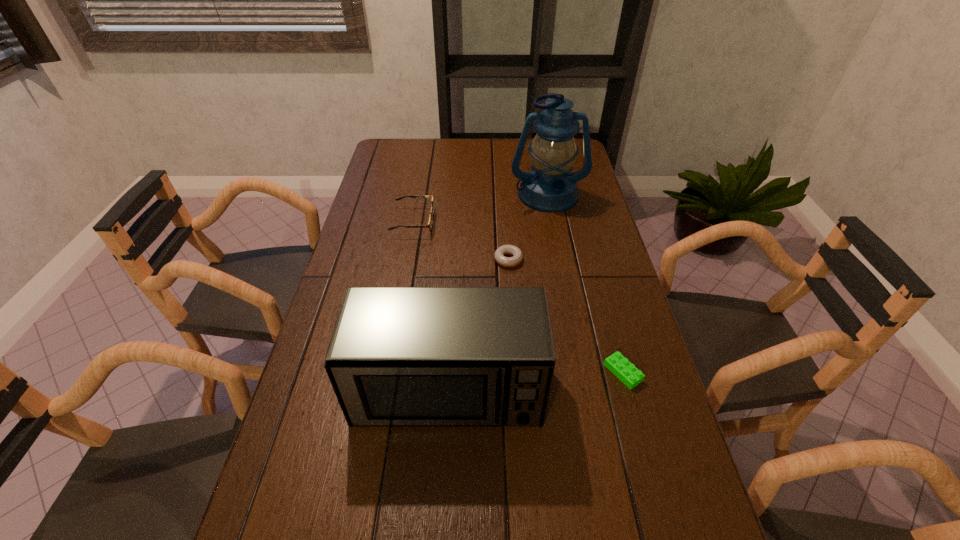
I want to click on lantern, so click(x=550, y=187).

The width and height of the screenshot is (960, 540). I want to click on the fourth shortest object, so click(399, 356).

Locate an element on the screen. spectacles is located at coordinates (430, 224).

Find the location of `doughnut`. doughnut is located at coordinates (517, 258).

Where is `Lego`? Lego is located at coordinates point(624,370).

You are a GUI agent. You are given a task and a screenshot of the screen. Output one action in this format:
    pyautogui.click(x=<x>, y=<y>)
    Task: Click on the free space located 0.210m on the face of the lantern
    Image resolution: width=960 pixels, height=540 pixels.
    Given the screenshot: What is the action you would take?
    pyautogui.click(x=560, y=254)

Identify the location of vacant space situated 0.050m on the front-facing side of the fourth shortest object. This screenshot has width=960, height=540. (444, 456).

You are a GUI agent. You are given a task and a screenshot of the screen. Output one action in this format:
    pyautogui.click(x=<x>, y=<y>)
    Task: Click on the free spot located on the frame of the third shortest object
    The image size is (960, 540).
    Given the screenshot: What is the action you would take?
    pyautogui.click(x=535, y=221)

Identify the location of vacant space located on the right of the third nearest object. Image resolution: width=960 pixels, height=540 pixels. (577, 259).

The image size is (960, 540). In order to click on blank space located on the back of the Lego in this screenshot , I will do `click(591, 258)`.